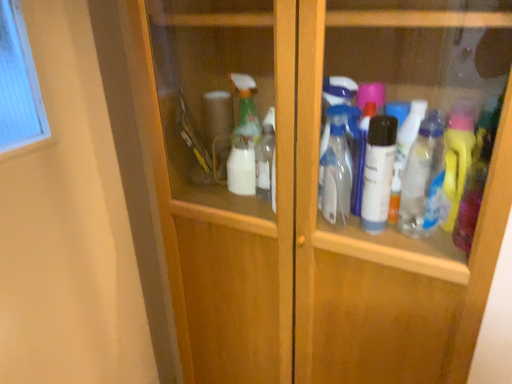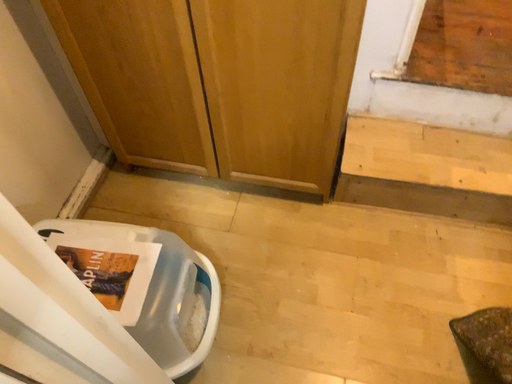
Question: Which way did the camera rotate in the video?

Choices:
 (A) rotated right
 (B) rotated left

Answer: (A)